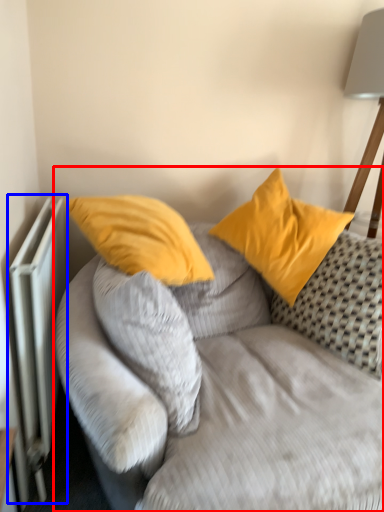
Question: Which object is further to the camera taking this photo, studio couch (highlighted by a red box) or radiator (highlighted by a blue box)?

Choices:
 (A) studio couch
 (B) radiator

Answer: (B)